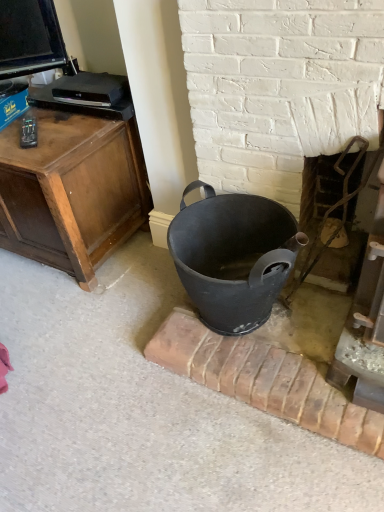
Question: Relative to rustic metal fireplace at right, positioned as the second fireplace in left-to-right order, is matte black bucket at center, the first fireplace when ordered from left to right, in front or behind?

Choices:
 (A) behind
 (B) front

Answer: (B)

Question: From a real-world perspective, is matte black bucket at center, placed as the 2th fireplace when sorted from right to left, physically located above or below rustic metal fireplace at right, acting as the first fireplace starting from the right?

Choices:
 (A) below
 (B) above

Answer: (B)

Question: Estimate the real-world distances between objects in this image. Which object is farther from the matte black bucket at center, the first fireplace when ordered from left to right?

Choices:
 (A) matte black trash can at center
 (B) rustic metal fireplace at right, acting as the first fireplace starting from the right

Answer: (A)

Question: Estimate the real-world distances between objects in this image. Which object is farther from the matte black trash can at center?

Choices:
 (A) rustic metal fireplace at right, acting as the first fireplace starting from the right
 (B) matte black bucket at center, the first fireplace when ordered from left to right

Answer: (A)